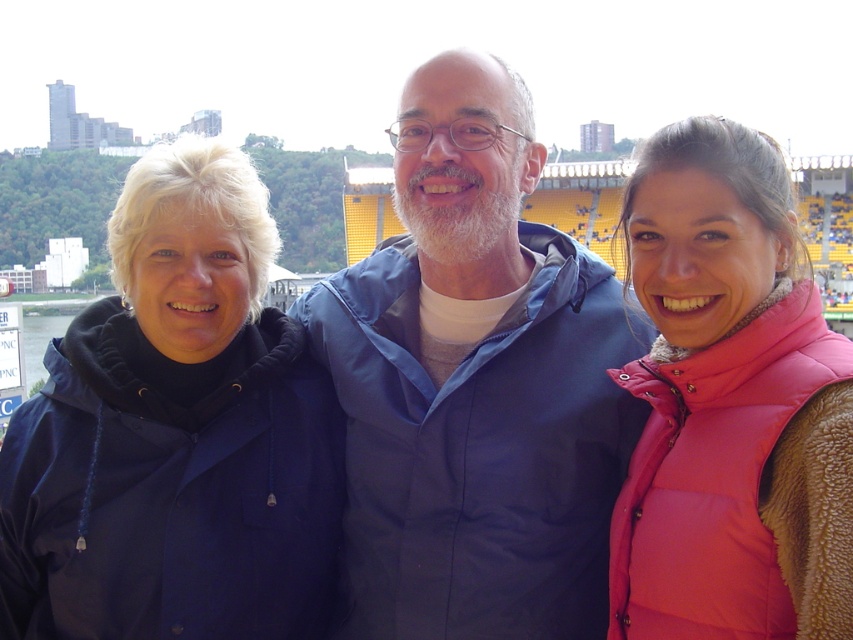
Question: Where is navy blue jacket at left located in relation to pink puffy vest at center in the image?

Choices:
 (A) below
 (B) above

Answer: (A)

Question: Is navy blue jacket at left to the left of pink puffy vest at center from the viewer's perspective?

Choices:
 (A) no
 (B) yes

Answer: (B)

Question: Among these points, which one is farthest from the camera?

Choices:
 (A) pyautogui.click(x=584, y=268)
 (B) pyautogui.click(x=256, y=218)

Answer: (A)

Question: Does navy blue jacket at left appear on the left side of pink puffy vest at center?

Choices:
 (A) no
 (B) yes

Answer: (B)

Question: Which of the following is the closest to the observer?

Choices:
 (A) navy blue jacket at left
 (B) pink puffy vest at center

Answer: (B)

Question: Which point is farther to the camera?

Choices:
 (A) pink puffy vest at center
 (B) navy blue jacket at left
 (C) blue fabric jacket at center

Answer: (C)